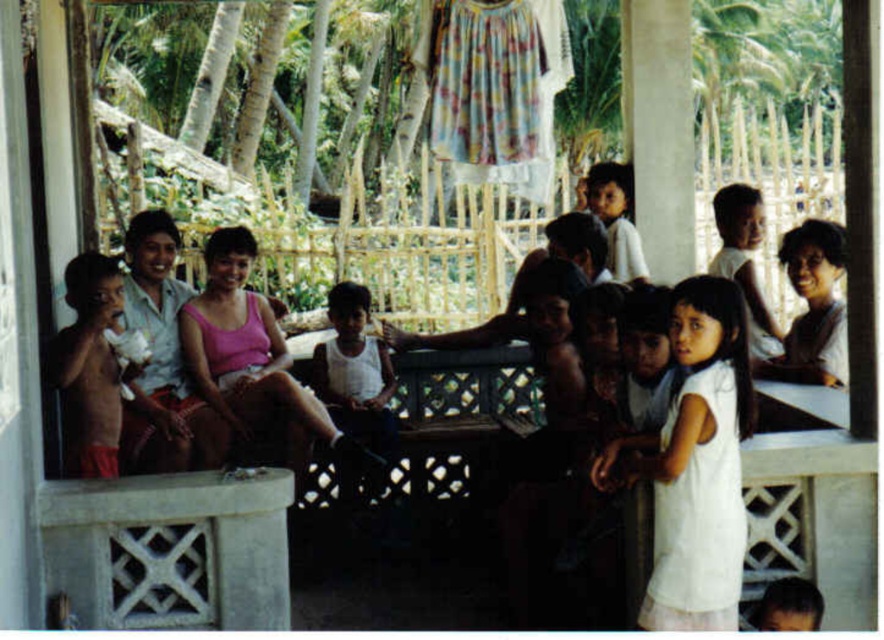
You are a photographer trying to capture a candid shot of the family on the porch. You notice the white cotton dress at lower right and the light brown skin at upper right. Which object is positioned more to the left side of the scene?

The white cotton dress at lower right is positioned more to the left side of the scene compared to the light brown skin at upper right.

You are a photographer taking a picture of the scene. You notice the smooth white shirt at right and the light brown skin at upper right. Which object should you focus on first if you want to capture both in the same frame without moving the camera?

You should focus on the smooth white shirt at right first because it is below the light brown skin at upper right, so adjusting focus from the lower to upper area will help capture both in the same frame.